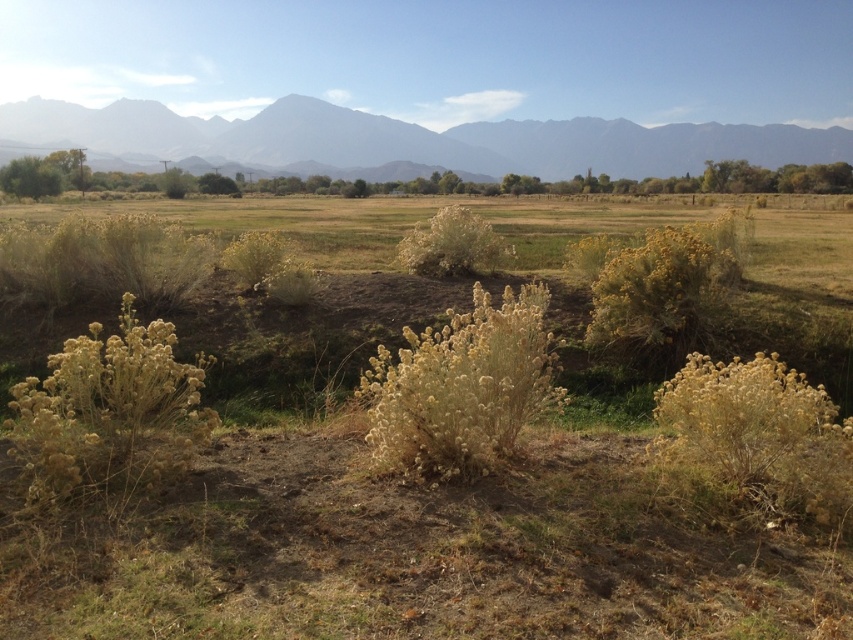
You are standing in the middle of the open field and want to walk towards the green leafy bush at left and the yellow fluffy bush at center. Which bush will you encounter first?

The green leafy bush at left will be encountered first because it is positioned in front of the yellow fluffy bush at center, making it closer to your current position in the middle of the open field.

You are an artist painting the landscape described. You want to ensure the fuzzy yellow bush at left is visible in the painting. Given the gray rocky mountain range at upper center is in the way, how should you position the bush relative to the mountain range?

The fuzzy yellow bush at left is behind the gray rocky mountain range at upper center, so to make it visible in the painting, position it in front of the mountain range.

You are an environmental scientist examining the landscape. You notice the green leafy bush at left and the yellow fluffy bush at center. Based on their positions, which one is closer to the ground?

The green leafy bush at left is located below the yellow fluffy bush at center, so it is closer to the ground.